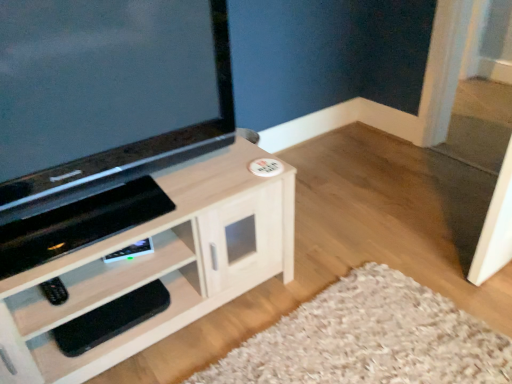
Question: Is black matte remote at lower left in front of or behind matte black tv at upper left in the image?

Choices:
 (A) front
 (B) behind

Answer: (B)

Question: Is black matte remote at lower left wider or thinner than matte black tv at upper left?

Choices:
 (A) wide
 (B) thin

Answer: (B)

Question: Based on their relative distances, which object is nearer to the black rubber footrest at lower left?

Choices:
 (A) matte black tv at upper left
 (B) light wood cabinet at center
 (C) black matte remote at lower left

Answer: (C)

Question: Which of these objects is positioned farthest from the matte black tv at upper left?

Choices:
 (A) black rubber footrest at lower left
 (B) light wood cabinet at center
 (C) black matte remote at lower left

Answer: (C)